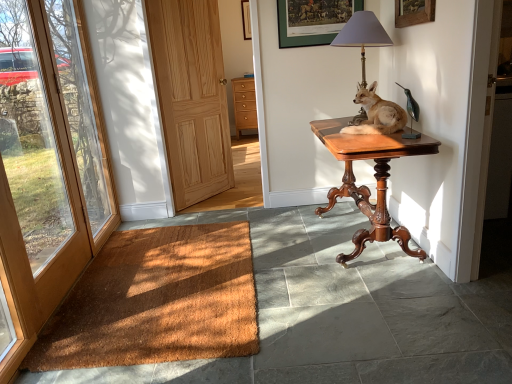
Identify the location of vacant area situated to the left side of mahogany wood table at center. This screenshot has width=512, height=384. (283, 243).